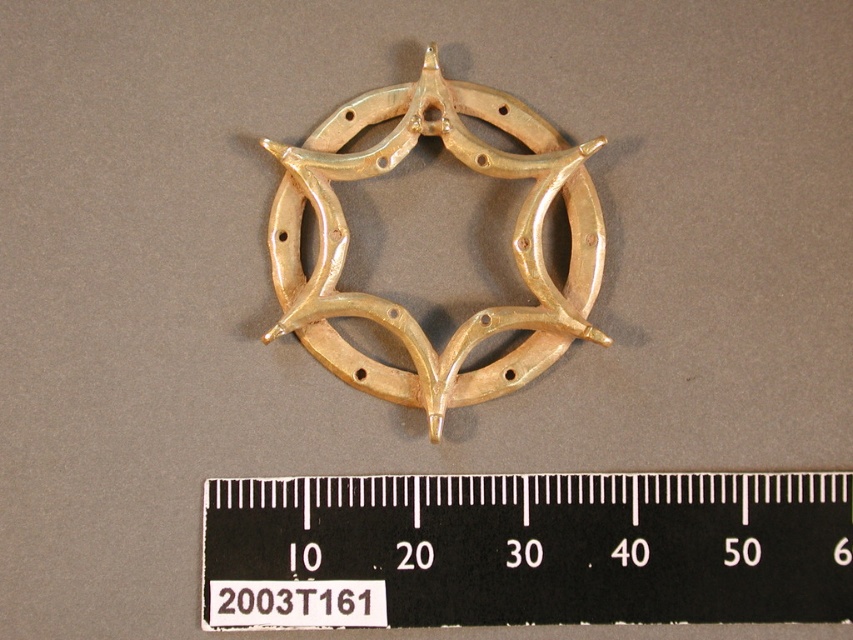
You are an artist trying to sketch the gold metallic horseshoe at center and the black plastic ruler at center from the image. Based on their positions, which object should you draw first if you want to start from the left side of the paper?

You should draw the gold metallic horseshoe at center first because the black plastic ruler at center is to the right of it, so starting from the left side of the paper, the horseshoe comes first.

You are an appraiser examining the image of a gold metallic horseshoe at center and a black plastic ruler at center. Which object is positioned in front of the other?

The black plastic ruler at center is closer to the viewer than the gold metallic horseshoe at center, so the black plastic ruler at center is positioned in front of the gold metallic horseshoe at center.